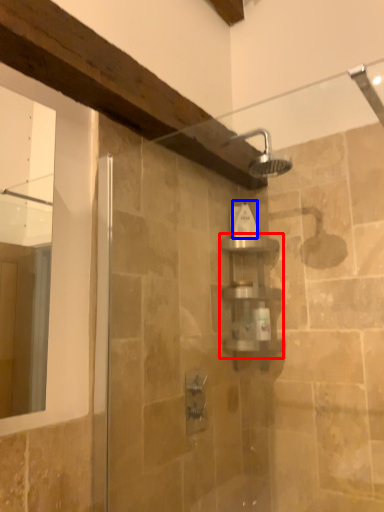
Question: Which object is further to the camera taking this photo, shelf (highlighted by a red box) or toiletry (highlighted by a blue box)?

Choices:
 (A) shelf
 (B) toiletry

Answer: (B)